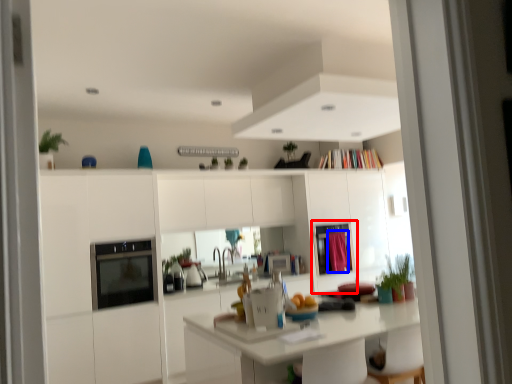
Question: Which object appears farthest to the camera in this image, screen door (highlighted by a red box) or curtain (highlighted by a blue box)?

Choices:
 (A) screen door
 (B) curtain

Answer: (B)